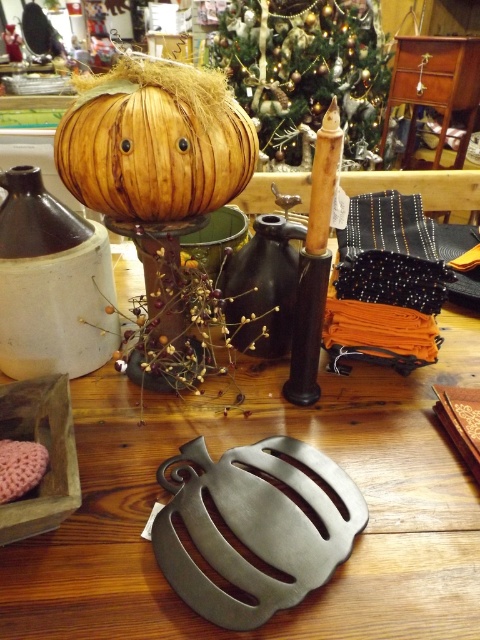
You are arranging items on a shelf and need to place the metallic gray trivet at center and the wooden pumpkin at center. According to the scene, which item is positioned to the right of the other?

The metallic gray trivet at center is to the right of the wooden pumpkin at center.